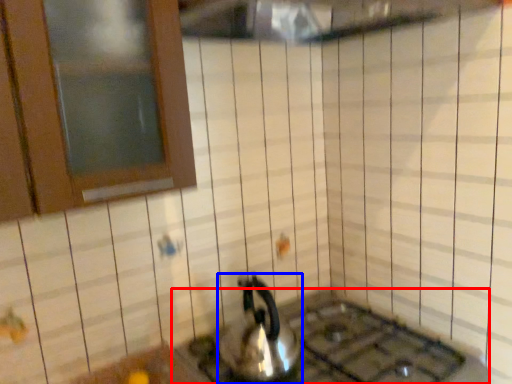
Question: Which point is further to the camera, gas stove (highlighted by a red box) or kettle (highlighted by a blue box)?

Choices:
 (A) gas stove
 (B) kettle

Answer: (B)